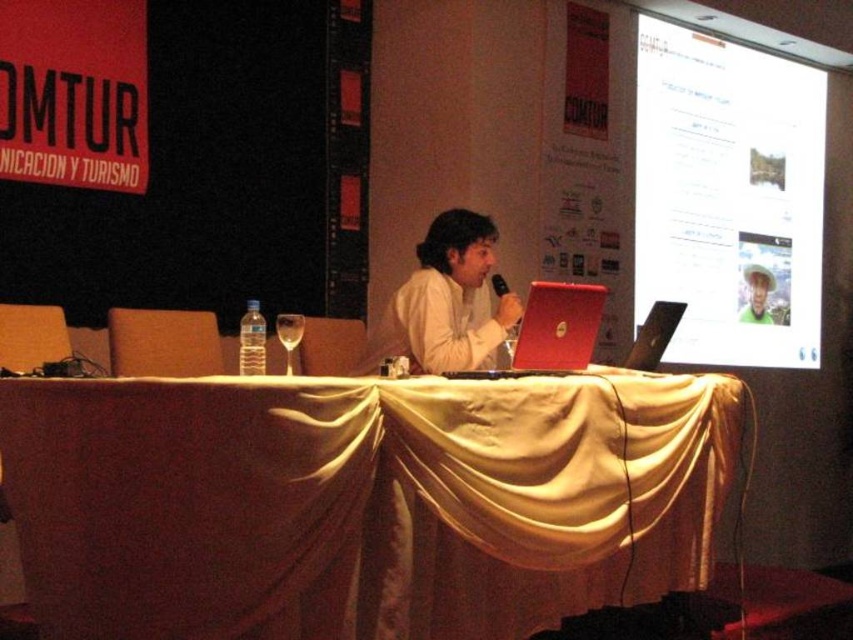
Question: Among these points, which one is nearest to the camera?

Choices:
 (A) (503, 289)
 (B) (532, 365)
 (C) (439, 276)
 (D) (756, 278)

Answer: (B)

Question: Does white matte shirt at center lie behind green matte hat at upper right?

Choices:
 (A) no
 (B) yes

Answer: (A)

Question: Which object appears farthest from the camera in this image?

Choices:
 (A) white matte shirt at center
 (B) white satin table at center
 (C) black plastic microphone at center
 (D) white glossy screen at upper right

Answer: (D)

Question: Can you confirm if red matte laptop at center is positioned below green matte hat at upper right?

Choices:
 (A) yes
 (B) no

Answer: (A)

Question: Among these points, which one is farthest from the camera?

Choices:
 (A) (747, 108)
 (B) (476, 368)
 (C) (48, 454)
 (D) (502, 276)

Answer: (A)

Question: Does white matte shirt at center appear under green matte hat at upper right?

Choices:
 (A) yes
 (B) no

Answer: (A)